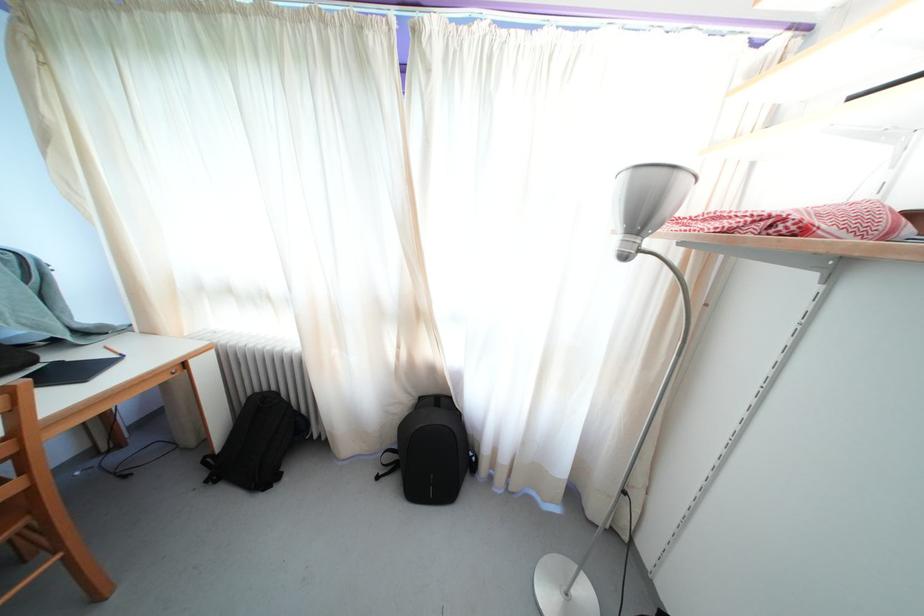
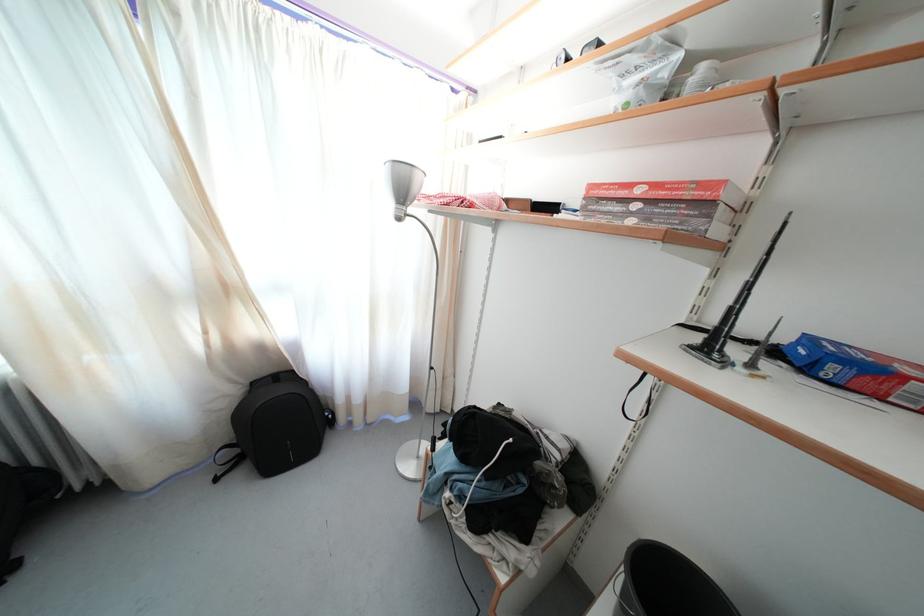
In the second image, find the point that corresponds to point (648, 223) in the first image.

(408, 199)